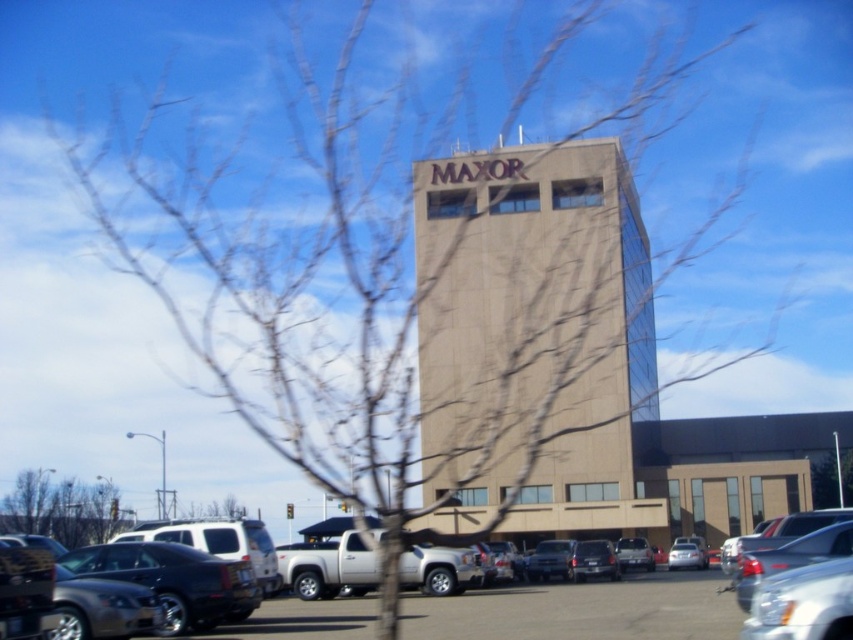
The image size is (853, 640). What do you see at coordinates (537, 330) in the screenshot? I see `beige concrete building at center` at bounding box center [537, 330].

Is beige concrete building at center taller than satin silver sedan at lower center?

Correct, beige concrete building at center is much taller as satin silver sedan at lower center.

Does point (526, 317) lie behind point (677, 557)?

Yes, it is.

You are a GUI agent. You are given a task and a screenshot of the screen. Output one action in this format:
    pyautogui.click(x=<x>, y=<y>)
    Task: Click on the beige concrete building at center
    The height and width of the screenshot is (640, 853).
    Given the screenshot: What is the action you would take?
    pyautogui.click(x=537, y=330)

Between beige concrete building at center and satin black sedan at center, which one is positioned higher?

Positioned higher is beige concrete building at center.

How far apart are beige concrete building at center and satin black sedan at center?

beige concrete building at center is 17.69 meters from satin black sedan at center.

Image resolution: width=853 pixels, height=640 pixels. I want to click on beige concrete building at center, so click(537, 330).

Identify the location of beige concrete building at center. This screenshot has width=853, height=640. (537, 330).

Is point (587, 573) behind point (636, 564)?

No, (587, 573) is closer to viewer.

This screenshot has width=853, height=640. Describe the element at coordinates (593, 561) in the screenshot. I see `matte black suv at center` at that location.

Between point (599, 566) and point (643, 563), which one is positioned in front?

Point (599, 566) is more forward.

Where is `matte black suv at center`? The width and height of the screenshot is (853, 640). matte black suv at center is located at coordinates (593, 561).